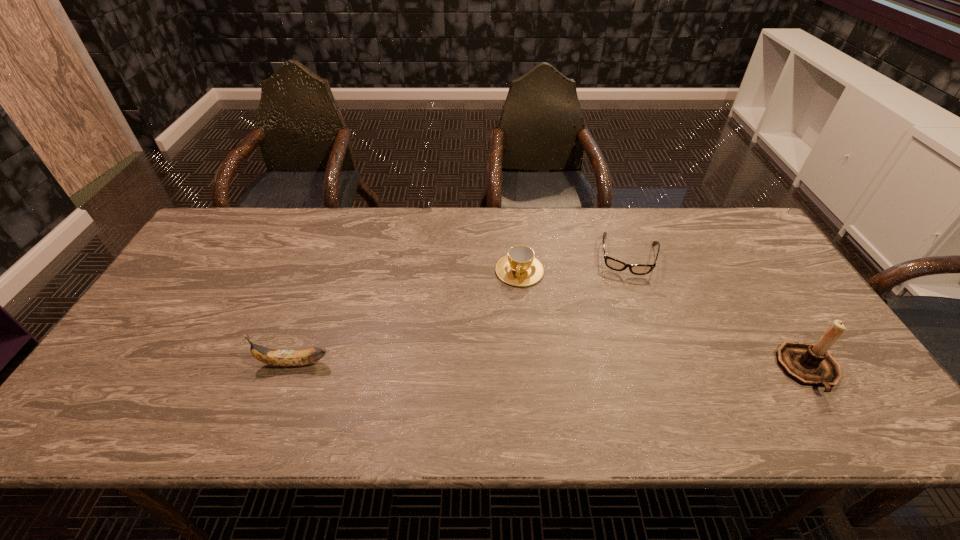
You are a GUI agent. You are given a task and a screenshot of the screen. Output one action in this format:
    pyautogui.click(x=<x>, y=<y>)
    Task: Click on the candle holder that is at the near edge
    
    Given the screenshot: What is the action you would take?
    pyautogui.click(x=809, y=364)

Where is `object situated at the right edge`? object situated at the right edge is located at coordinates (809, 364).

Identify the location of object located at the near right corner. The image size is (960, 540). (809, 364).

Locate an element on the screen. vacant space at the far edge of the desktop is located at coordinates (639, 229).

You are a GUI agent. You are given a task and a screenshot of the screen. Output one action in this format:
    pyautogui.click(x=<x>, y=<y>)
    Task: Click on the blank space at the near edge
    
    Given the screenshot: What is the action you would take?
    pyautogui.click(x=492, y=373)

This screenshot has height=540, width=960. In the image, there is a desktop. Identify the location of vacant space at the right edge. (793, 327).

The image size is (960, 540). What are the coordinates of `free space at the far right corner of the desktop` in the screenshot? It's located at (740, 217).

Where is `free area in between the cup and the candle holder`? This screenshot has width=960, height=540. free area in between the cup and the candle holder is located at coordinates (664, 320).

Where is `free space between the second object from right to left and the third tallest object`? The width and height of the screenshot is (960, 540). free space between the second object from right to left and the third tallest object is located at coordinates (574, 263).

The width and height of the screenshot is (960, 540). Find the location of `vacant region between the second tallest object and the rightmost object`. vacant region between the second tallest object and the rightmost object is located at coordinates (551, 367).